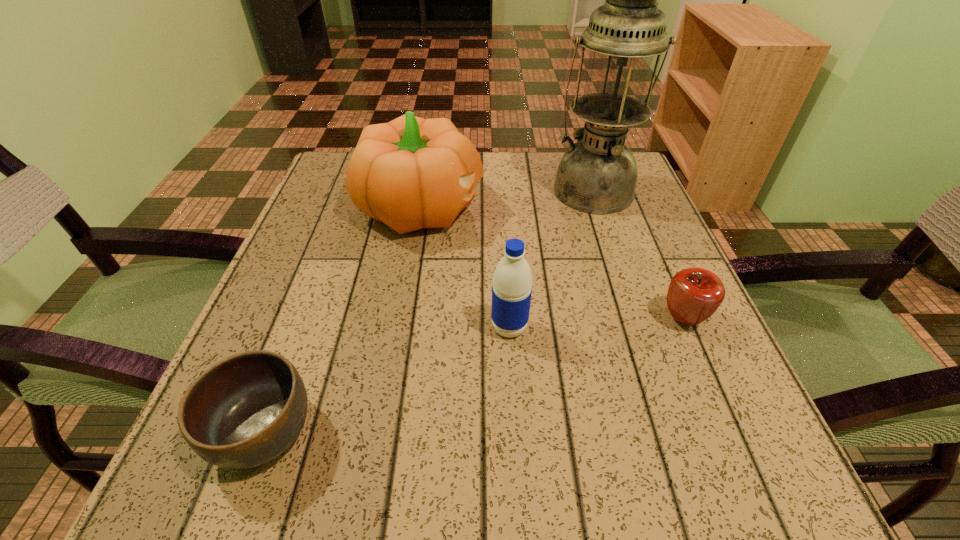
The image size is (960, 540). Find the location of `oil lamp`. oil lamp is located at coordinates (598, 174).

This screenshot has height=540, width=960. What are the coordinates of `pumpkin` in the screenshot? It's located at (411, 173).

What are the coordinates of `water bottle` in the screenshot? It's located at (512, 282).

Find the location of a particular element. The height and width of the screenshot is (540, 960). the third object from left to right is located at coordinates pyautogui.click(x=512, y=282).

Where is `apple`? apple is located at coordinates (694, 294).

Where is `bowl`? bowl is located at coordinates (244, 411).

Find the location of `vacant space situated on the left of the oil lamp`. vacant space situated on the left of the oil lamp is located at coordinates (504, 190).

The width and height of the screenshot is (960, 540). Find the location of `vacant position located 0.350m on the carved face of the pumpkin`. vacant position located 0.350m on the carved face of the pumpkin is located at coordinates (646, 207).

Where is `vacant space located on the front of the water bottle`? The height and width of the screenshot is (540, 960). vacant space located on the front of the water bottle is located at coordinates (517, 463).

Where is `vacant position located on the left of the apple`? The width and height of the screenshot is (960, 540). vacant position located on the left of the apple is located at coordinates click(x=441, y=319).